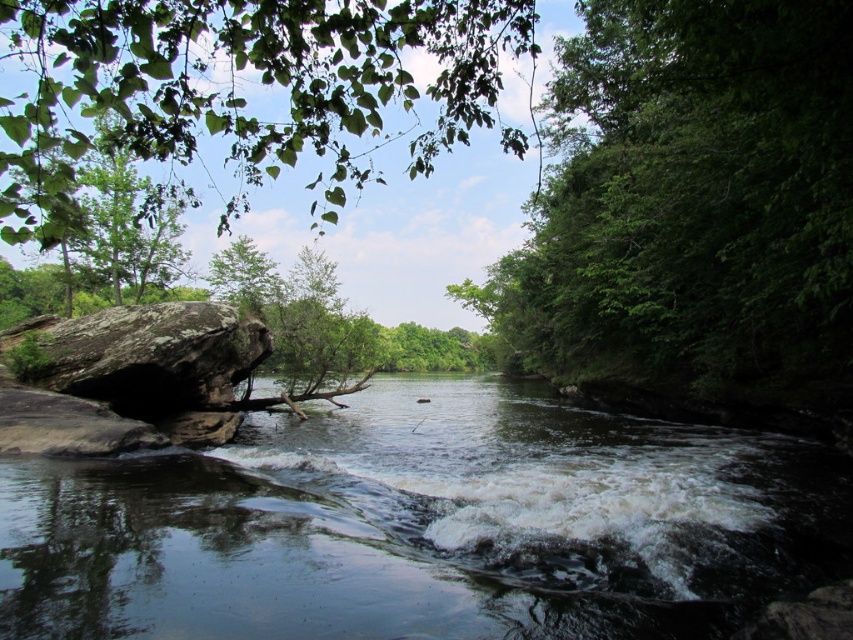
You are standing at the center of the image and want to locate the green leafy tree at upper left. In which direction should you look relative to your position?

The green leafy tree at upper left is located at point coordinates indicating it is to the upper left direction from your current position at the center of the image.

You are an environmental scientist assessing the river ecosystem. You observe the green leafy tree at upper left and the rough textured rock at left. Which object contributes more to the water reflection in the river?

The green leafy tree at upper left contributes more to the water reflection in the river because it is bigger than the rough textured rock at left, and larger objects typically cast larger reflections.

You are standing at the edge of the river and want to take a photo of the green leafy tree at right. If your camera has a maximum zoom range of 4 meters, will you be able to capture the entire tree without moving closer?

The green leafy tree at right is 4.48 meters away from the camera. Since the camera can only zoom up to 4 meters, you won not be able to capture the entire tree without moving closer.